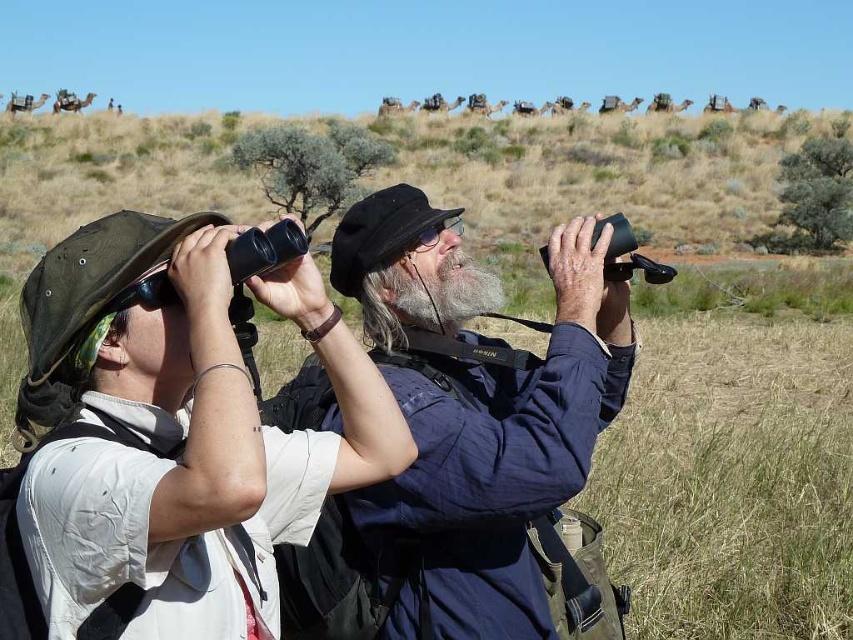
Between matte black binoculars at left and graywoollybeard at center, which one has less height?

With less height is graywoollybeard at center.

Image resolution: width=853 pixels, height=640 pixels. I want to click on matte black binoculars at left, so click(x=167, y=440).

The height and width of the screenshot is (640, 853). In order to click on matte black binoculars at left in this screenshot , I will do `click(167, 440)`.

Between point (444, 595) and point (396, 307), which one is positioned behind?

The point (396, 307) is behind.

Can you confirm if blue fabric jacket at center is wider than graywoollybeard at center?

Yes.

Is point (494, 577) farther from viewer compared to point (444, 305)?

No, (494, 577) is closer to viewer.

Locate an element on the screen. The image size is (853, 640). blue fabric jacket at center is located at coordinates (479, 417).

Between matte black binoculars at left and blue fabric jacket at center, which one appears on the right side from the viewer's perspective?

From the viewer's perspective, blue fabric jacket at center appears more on the right side.

Does matte black binoculars at left appear under blue fabric jacket at center?

Incorrect, matte black binoculars at left is not positioned below blue fabric jacket at center.

Does point (181, 529) come behind point (331, 420)?

No, it is in front of (331, 420).

At what (x,y) coordinates should I click in order to perform the action: click on matte black binoculars at left. Please return your answer as a coordinate pair (x, y). Image resolution: width=853 pixels, height=640 pixels. Looking at the image, I should click on (167, 440).